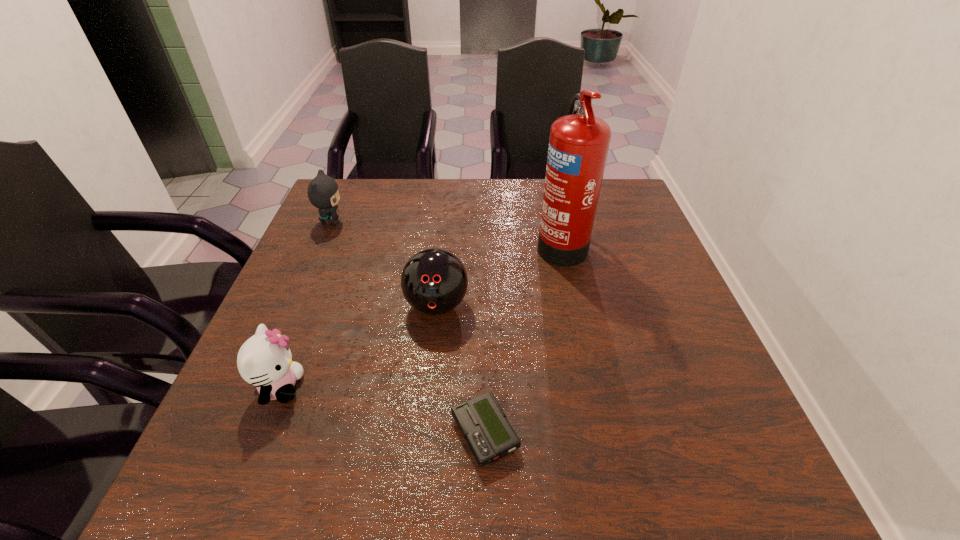
In the image, there is a desktop. Identify the location of vacant space at the right edge. Image resolution: width=960 pixels, height=540 pixels. (660, 325).

At what (x,y) coordinates should I click in order to perform the action: click on vacant space at the far left corner of the desktop. Please return your answer as a coordinate pair (x, y). Looking at the image, I should click on (359, 207).

The width and height of the screenshot is (960, 540). What are the coordinates of `vacant area at the near left corner of the desktop` in the screenshot? It's located at (276, 491).

Locate an element on the screen. empty space between the farther kitten and the nearer kitten is located at coordinates (305, 304).

I want to click on empty space that is in between the beeper and the third nearest object, so click(x=461, y=369).

Locate an element on the screen. This screenshot has width=960, height=540. vacant space that is in between the shortest object and the farther kitten is located at coordinates (408, 327).

In order to click on vacant area that lies between the nearer kitten and the fire extinguisher in this screenshot , I will do `click(420, 315)`.

Where is `free space between the farther kitten and the rightmost object`? Image resolution: width=960 pixels, height=540 pixels. free space between the farther kitten and the rightmost object is located at coordinates (446, 232).

Where is `free spot between the nearer kitten and the third nearest object`? This screenshot has width=960, height=540. free spot between the nearer kitten and the third nearest object is located at coordinates (358, 346).

Identify the location of free space that is in between the farther kitten and the fire extinguisher. pos(446,232).